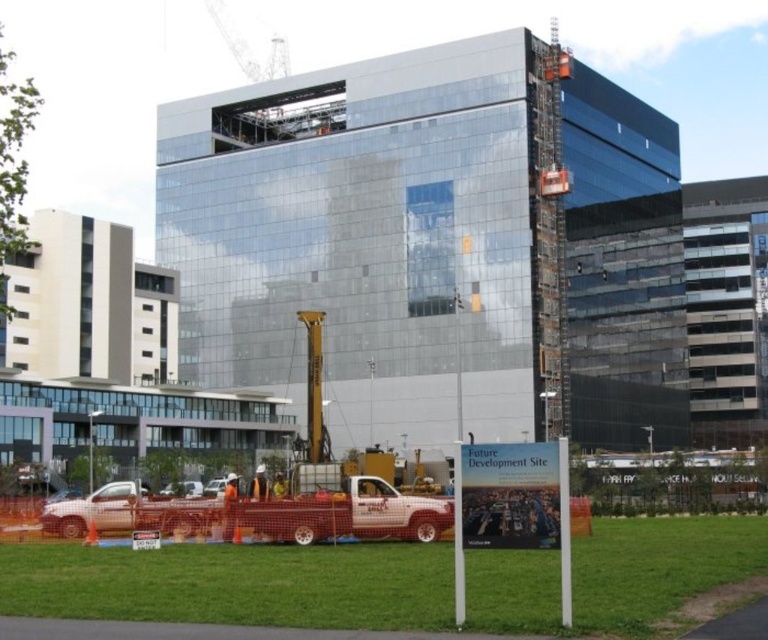
The height and width of the screenshot is (640, 768). Describe the element at coordinates (94, 509) in the screenshot. I see `metallic silver car at lower left` at that location.

Can you confirm if metallic silver car at lower left is smaller than white matte truck at lower left?

Yes, metallic silver car at lower left is smaller than white matte truck at lower left.

Where is `metallic silver car at lower left`? The width and height of the screenshot is (768, 640). metallic silver car at lower left is located at coordinates tap(94, 509).

Is point (505, 552) farther from viewer compared to point (123, 506)?

No, (505, 552) is in front of (123, 506).

Consider the image. Who is more distant from viewer, (654, 582) or (88, 508)?

Point (88, 508)

Which is behind, point (184, 596) or point (101, 518)?

Point (101, 518)

This screenshot has height=640, width=768. Identify the location of green grass at lower center. (234, 582).

Can you confirm if green grass at lower center is thinner than white matte truck at lower left?

No, green grass at lower center is not thinner than white matte truck at lower left.

Which is behind, point (121, 616) or point (164, 492)?

Positioned behind is point (164, 492).

This screenshot has width=768, height=640. I want to click on green grass at lower center, so click(234, 582).